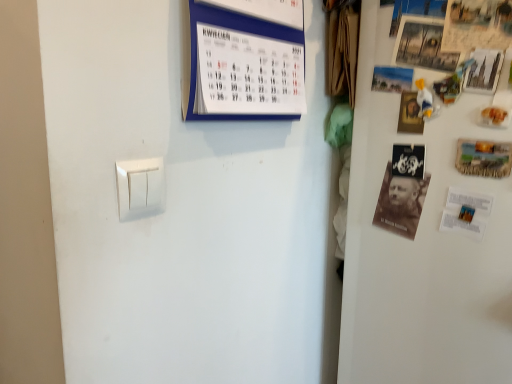
Question: From a real-world perspective, is matte paper poster at upper right, which ranks as the third poster in right-to-left order, physically above wooden postcard at right?

Choices:
 (A) yes
 (B) no

Answer: (A)

Question: Can you confirm if matte paper poster at upper right, which ranks as the third poster in right-to-left order, is taller than wooden postcard at right?

Choices:
 (A) no
 (B) yes

Answer: (A)

Question: Can you confirm if matte paper poster at upper right, positioned as the 1th poster in left-to-right order, is wider than wooden postcard at right?

Choices:
 (A) no
 (B) yes

Answer: (B)

Question: Can you confirm if matte paper poster at upper right, positioned as the 1th poster in left-to-right order, is bigger than wooden postcard at right?

Choices:
 (A) yes
 (B) no

Answer: (A)

Question: Considering the relative positions of matte paper poster at upper right, positioned as the 1th poster in left-to-right order, and wooden postcard at right in the image provided, is matte paper poster at upper right, positioned as the 1th poster in left-to-right order, behind wooden postcard at right?

Choices:
 (A) no
 (B) yes

Answer: (B)

Question: Can you see matte paper poster at upper right, which ranks as the third poster in right-to-left order, touching wooden postcard at right?

Choices:
 (A) yes
 (B) no

Answer: (B)

Question: Would you consider brown paper at right, the 2th magazine when ordered from top to bottom, to be distant from matte paper poster at upper right, which ranks as the third poster in right-to-left order?

Choices:
 (A) no
 (B) yes

Answer: (A)

Question: Can you see brown paper at right, the 2th magazine when ordered from top to bottom, touching matte paper poster at upper right, which ranks as the third poster in right-to-left order?

Choices:
 (A) yes
 (B) no

Answer: (B)

Question: Could you tell me if brown paper at right, acting as the first magazine starting from the right, is turned towards matte paper poster at upper right, positioned as the 1th poster in left-to-right order?

Choices:
 (A) yes
 (B) no

Answer: (B)

Question: Is brown paper at right, which is counted as the first magazine, starting from the bottom, oriented away from matte paper poster at upper right, which ranks as the third poster in right-to-left order?

Choices:
 (A) yes
 (B) no

Answer: (B)

Question: Does brown paper at right, which is counted as the first magazine, starting from the bottom, have a lesser width compared to matte paper poster at upper right, positioned as the 1th poster in left-to-right order?

Choices:
 (A) no
 (B) yes

Answer: (A)

Question: From the image's perspective, is brown paper at right, the 2th magazine from the left, located beneath matte paper poster at upper right, positioned as the 1th poster in left-to-right order?

Choices:
 (A) yes
 (B) no

Answer: (A)

Question: Can you confirm if wooden framed poster at upper right, marked as the 2th poster in a left-to-right arrangement, is positioned to the right of wooden postcard at right?

Choices:
 (A) no
 (B) yes

Answer: (A)